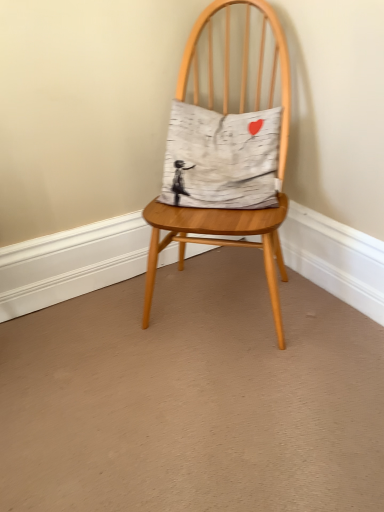
What do you see at coordinates (217, 242) in the screenshot? The width and height of the screenshot is (384, 512). I see `wooden chair at center` at bounding box center [217, 242].

You are a GUI agent. You are given a task and a screenshot of the screen. Output one action in this format:
    pyautogui.click(x=<x>, y=<y>)
    Task: Click on the wooden chair at center
    The width and height of the screenshot is (384, 512).
    Given the screenshot: What is the action you would take?
    pyautogui.click(x=217, y=242)

What is the approximate height of white cotton pillow at center?

The height of white cotton pillow at center is 12.49 inches.

At what (x,y) coordinates should I click in order to perform the action: click on white cotton pillow at center. Please return your answer as a coordinate pair (x, y). Image resolution: width=384 pixels, height=512 pixels. Looking at the image, I should click on (222, 158).

What do you see at coordinates (222, 158) in the screenshot?
I see `white cotton pillow at center` at bounding box center [222, 158].

Locate an element on the screen. The width and height of the screenshot is (384, 512). wooden chair at center is located at coordinates (217, 242).

Considering the relative positions of wooden chair at center and white cotton pillow at center in the image provided, is wooden chair at center to the left of white cotton pillow at center from the viewer's perspective?

In fact, wooden chair at center is to the right of white cotton pillow at center.

Is wooden chair at center in front of or behind white cotton pillow at center in the image?

Visually, wooden chair at center is located in front of white cotton pillow at center.

Considering the points (192, 231) and (190, 203), which point is in front, point (192, 231) or point (190, 203)?

The point (192, 231) is closer.

From the image's perspective, which one is positioned higher, wooden chair at center or white cotton pillow at center?

white cotton pillow at center is shown above in the image.

From a real-world perspective, between wooden chair at center and white cotton pillow at center, who is vertically higher?

white cotton pillow at center, from a real-world perspective.

Which of these two, wooden chair at center or white cotton pillow at center, is wider?

With larger width is wooden chair at center.

Who is shorter, wooden chair at center or white cotton pillow at center?

Standing shorter between the two is white cotton pillow at center.

Is wooden chair at center smaller than white cotton pillow at center?

Incorrect, wooden chair at center is not smaller in size than white cotton pillow at center.

Is wooden chair at center completely or partially outside of white cotton pillow at center?

Yes, wooden chair at center is located beyond the bounds of white cotton pillow at center.

Is the surface of wooden chair at center in direct contact with white cotton pillow at center?

No, wooden chair at center is not making contact with white cotton pillow at center.

Is wooden chair at center looking in the opposite direction of white cotton pillow at center?

Yes, white cotton pillow at center is at the back of wooden chair at center.

The height and width of the screenshot is (512, 384). I want to click on chair below the white cotton pillow at center (from the image's perspective), so point(217,242).

Is white cotton pillow at center to the right of wooden chair at center from the viewer's perspective?

No.

In the scene shown: Considering their positions, is white cotton pillow at center located in front of or behind wooden chair at center?

Clearly, white cotton pillow at center is behind wooden chair at center.

Does point (187, 176) come behind point (259, 70)?

No, (187, 176) is closer to viewer.

From the image's perspective, is white cotton pillow at center beneath wooden chair at center?

No.

From a real-world perspective, is white cotton pillow at center physically below wooden chair at center?

No, from a real-world perspective, white cotton pillow at center is not beneath wooden chair at center.

Considering the sizes of objects white cotton pillow at center and wooden chair at center in the image provided, who is thinner, white cotton pillow at center or wooden chair at center?

With smaller width is white cotton pillow at center.

Considering the sizes of white cotton pillow at center and wooden chair at center in the image, is white cotton pillow at center taller or shorter than wooden chair at center?

Considering their sizes, white cotton pillow at center has less height than wooden chair at center.

Looking at the image, does white cotton pillow at center seem bigger or smaller compared to wooden chair at center?

In the image, white cotton pillow at center appears to be smaller than wooden chair at center.

Does white cotton pillow at center contain wooden chair at center?

No, wooden chair at center is not a part of white cotton pillow at center.

Are white cotton pillow at center and wooden chair at center far apart?

No, white cotton pillow at center is not far away from wooden chair at center.

Is white cotton pillow at center positioned with its back to wooden chair at center?

Yes, white cotton pillow at center is facing away from wooden chair at center.

The width and height of the screenshot is (384, 512). Find the location of `pillow located on the left of wooden chair at center`. pillow located on the left of wooden chair at center is located at coordinates (222, 158).

Find the location of a particular element. pillow above the wooden chair at center (from a real-world perspective) is located at coordinates (222, 158).

What are the coordinates of `chair in front of the white cotton pillow at center` in the screenshot? It's located at (217, 242).